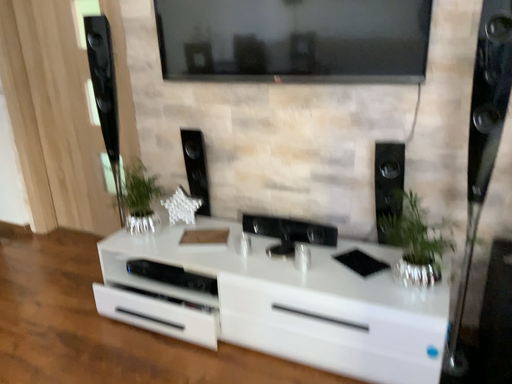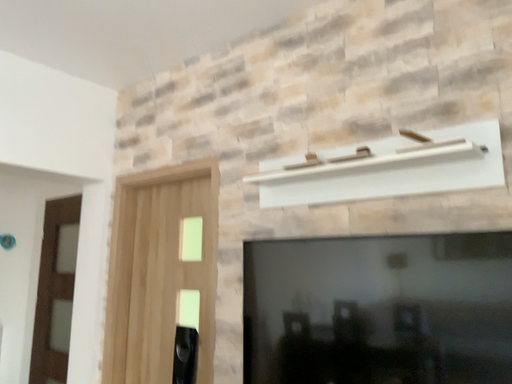
Question: How did the camera likely rotate when shooting the video?

Choices:
 (A) rotated right
 (B) rotated left

Answer: (B)